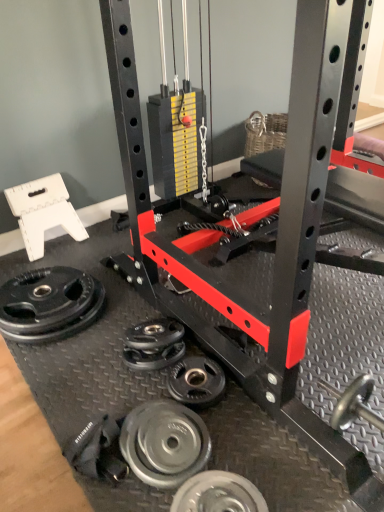
Where is `free space above black rubber weight plate at lower left, which ranks as the fourth wheel in front-to-back order (from a real-world perspective)`? This screenshot has height=512, width=384. free space above black rubber weight plate at lower left, which ranks as the fourth wheel in front-to-back order (from a real-world perspective) is located at coordinates (44, 290).